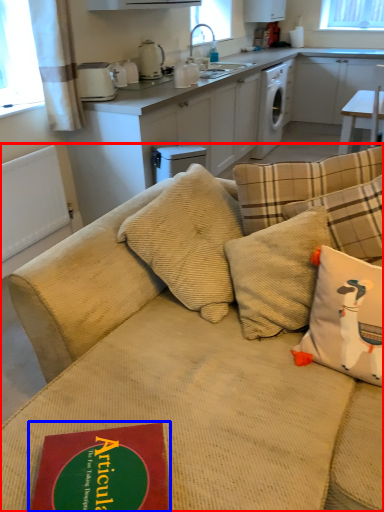
Question: Which object is closer to the camera taking this photo, studio couch (highlighted by a red box) or paperback book (highlighted by a blue box)?

Choices:
 (A) studio couch
 (B) paperback book

Answer: (A)